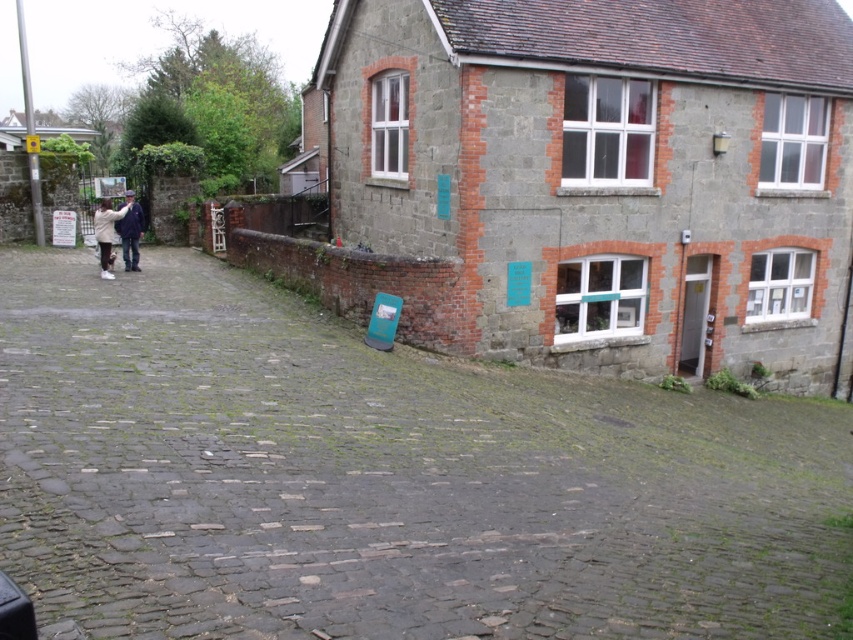
Question: Which of the following is the farthest from the observer?

Choices:
 (A) light brown leather jacket at left
 (B) brown cobblestone alley at center

Answer: (A)

Question: Is brown cobblestone alley at center behind light brown leather jacket at left?

Choices:
 (A) yes
 (B) no

Answer: (B)

Question: Which object is the farthest from the brown cobblestone alley at center?

Choices:
 (A) blue denim jacket at left
 (B) light brown leather jacket at left

Answer: (A)

Question: Can you confirm if brown cobblestone alley at center is positioned to the left of blue denim jacket at left?

Choices:
 (A) no
 (B) yes

Answer: (A)

Question: Is brown cobblestone alley at center above light brown leather jacket at left?

Choices:
 (A) no
 (B) yes

Answer: (A)

Question: Estimate the real-world distances between objects in this image. Which object is farther from the brown cobblestone alley at center?

Choices:
 (A) light brown leather jacket at left
 (B) blue denim jacket at left

Answer: (B)